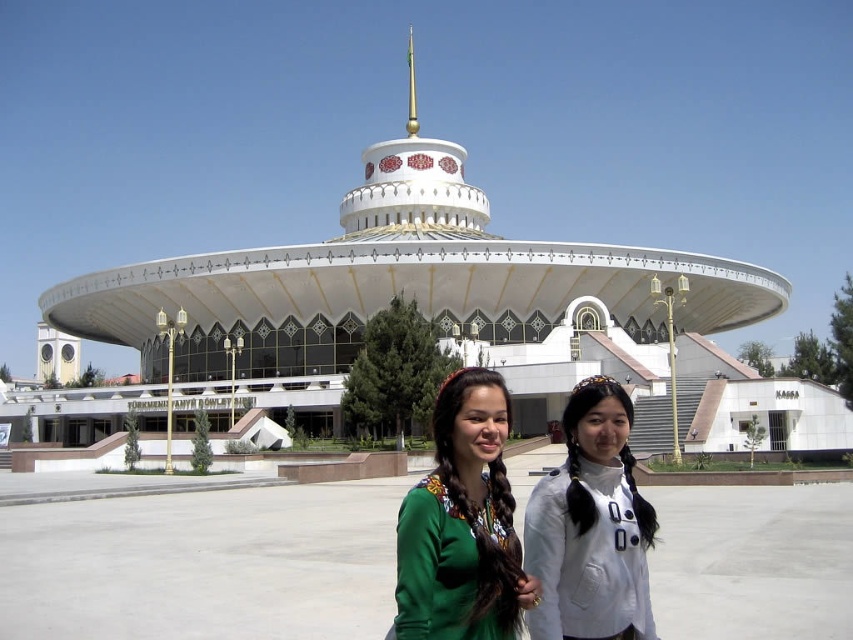
You are a photographer trying to capture both the green woven blouse at center and the white matte shirt at center in a single frame. Based on their positions, which one should you focus on first to ensure both are in the frame?

The green woven blouse at center is located below the white matte shirt at center, so you should focus on the white matte shirt at center first to ensure both are in the frame.

You are a photographer trying to capture a photo of both the green woven blouse at center and the white matte shirt at center. Which one should you focus on first if you want to include both in your frame without moving the camera?

The green woven blouse at center is positioned on the left side of white matte shirt at center, so focus on the white matte shirt at center first to ensure both are in the frame.